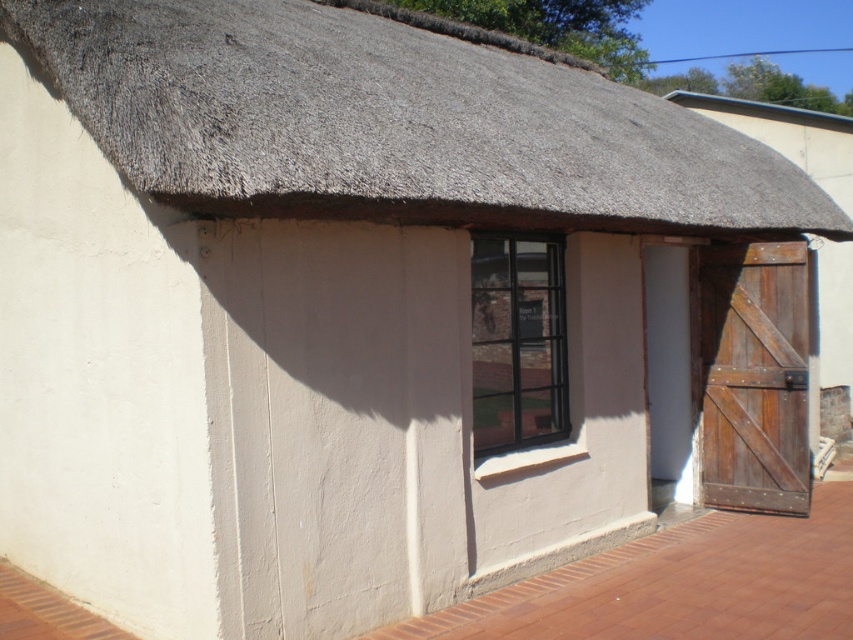
Question: Can you confirm if rustic wooden door at right is wider than black metal window at center?

Choices:
 (A) no
 (B) yes

Answer: (B)

Question: Which object is farther from the camera taking this photo?

Choices:
 (A) thatched straw roof at upper center
 (B) black metal window at center

Answer: (B)

Question: From the image, what is the correct spatial relationship of thatched straw roof at upper center in relation to black metal window at center?

Choices:
 (A) right
 (B) left

Answer: (B)

Question: From the image, what is the correct spatial relationship of rustic wooden door at right in relation to black metal window at center?

Choices:
 (A) above
 (B) below

Answer: (B)

Question: Which is farther from the thatched straw roof at upper center?

Choices:
 (A) black metal window at center
 (B) rustic wooden door at right

Answer: (B)

Question: Which object is positioned closest to the black metal window at center?

Choices:
 (A) rustic wooden door at right
 (B) thatched straw roof at upper center

Answer: (A)